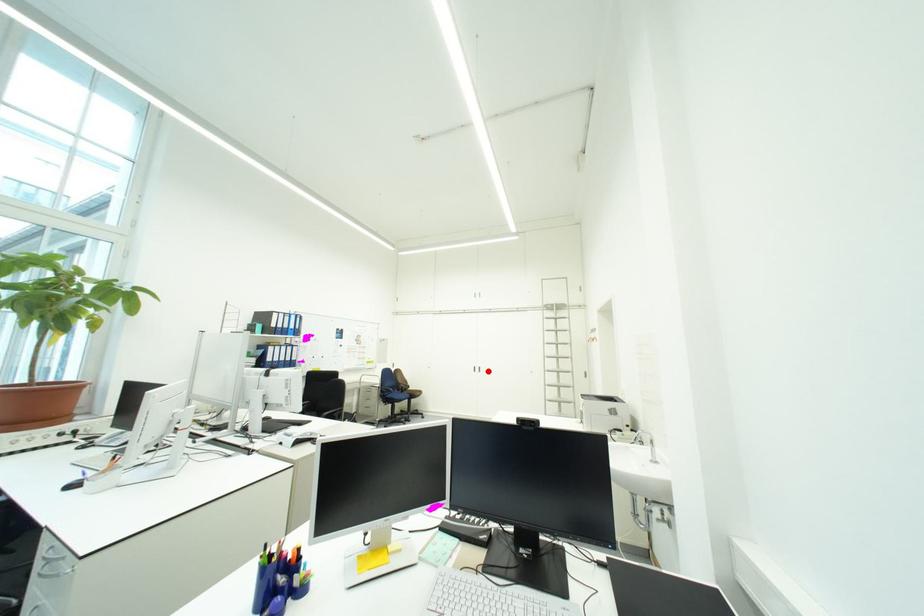
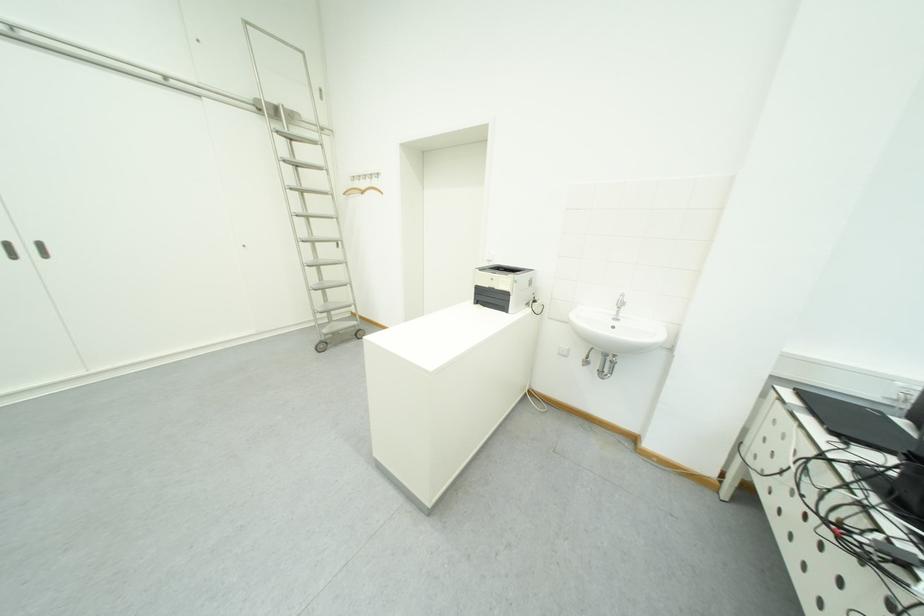
Find the pixel in the second image that matches the highlighted location in the first image.

(40, 252)